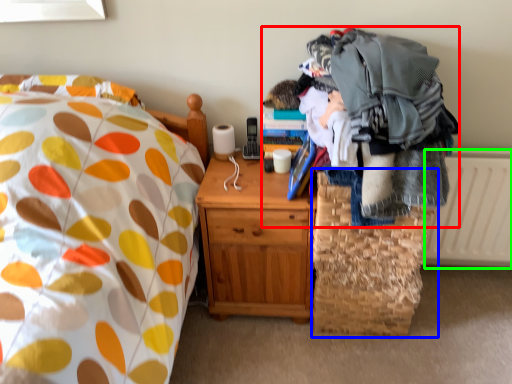
Question: Which object is positioned farthest from clothing (highlighted by a red box)? Select from basket (highlighted by a blue box) and radiator (highlighted by a green box).

Choices:
 (A) basket
 (B) radiator

Answer: (B)